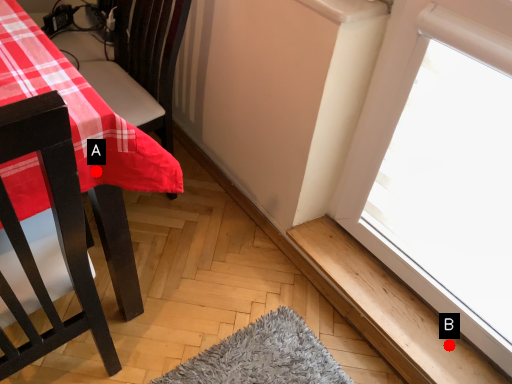
Question: Two points are circled on the image, labeled by A and B beside each circle. Which point appears closest to the camera in this image?

Choices:
 (A) A is closer
 (B) B is closer

Answer: (A)